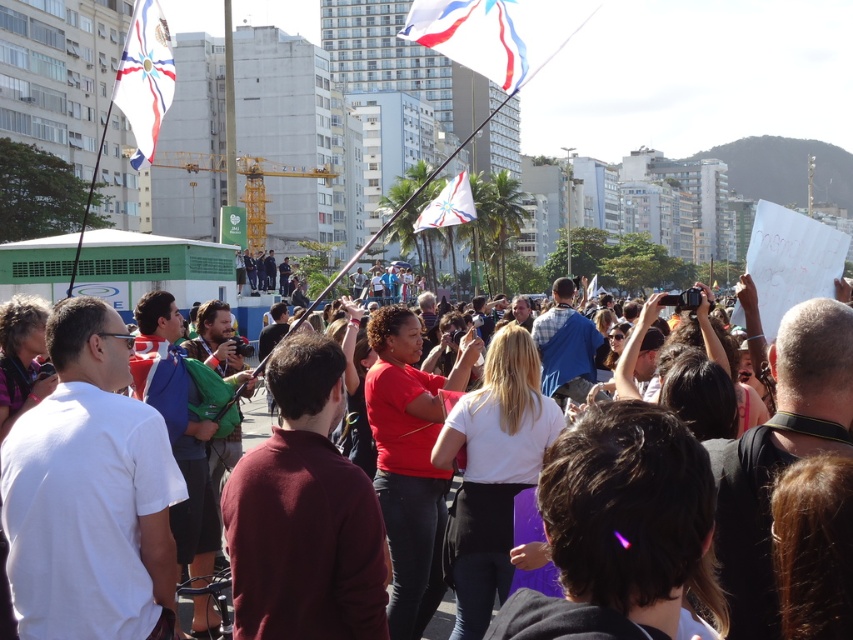
Is white fabric flag at upper left below matte black camera at center?

No, white fabric flag at upper left is not below matte black camera at center.

Which of these two, white fabric flag at upper left or matte black camera at center, stands taller?

matte black camera at center

Where is `white fabric flag at upper left`? The width and height of the screenshot is (853, 640). white fabric flag at upper left is located at coordinates (144, 77).

The image size is (853, 640). What are the coordinates of `white fabric flag at upper left` in the screenshot? It's located at (144, 77).

Is white fabric flag at upper center above white fabric flag at center?

No.

From the picture: Is white fabric flag at upper center further to the viewer compared to white fabric flag at center?

That is False.

Who is more distant from viewer, (509, 84) or (469, 202)?

The point (469, 202) is behind.

Where is `white fabric flag at upper center`? This screenshot has width=853, height=640. white fabric flag at upper center is located at coordinates (469, 36).

What do you see at coordinates (469, 36) in the screenshot? This screenshot has width=853, height=640. I see `white fabric flag at upper center` at bounding box center [469, 36].

Is point (511, 92) behind point (152, 33)?

No, (511, 92) is in front of (152, 33).

Where is `white fabric flag at upper center`? The width and height of the screenshot is (853, 640). white fabric flag at upper center is located at coordinates (469, 36).